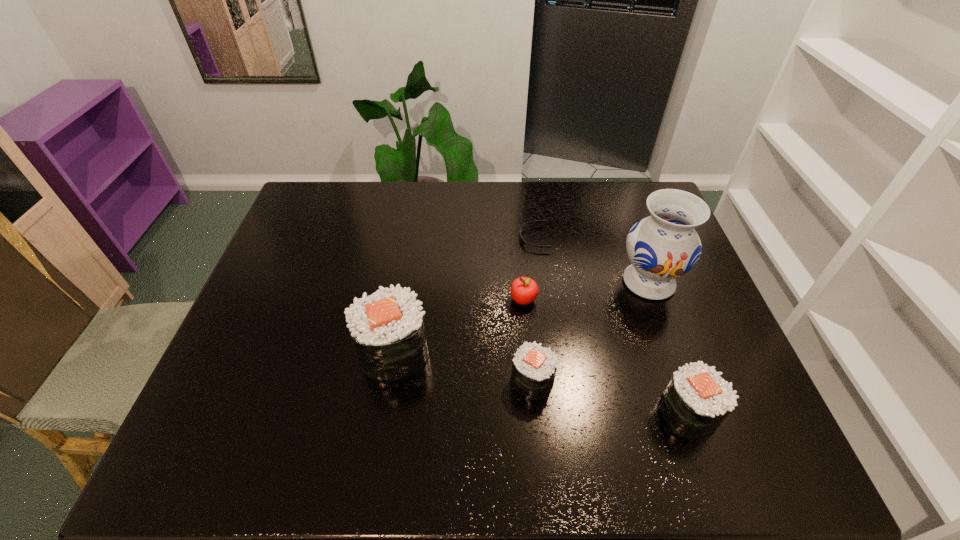
Please point a free position for a sushi on the left. Please provide its 2D coordinates. Your answer should be formatted as a tuple, i.e. [(x, y)], where the tuple contains the x and y coordinates of a point satisfying the conditions above.

[(268, 326)]